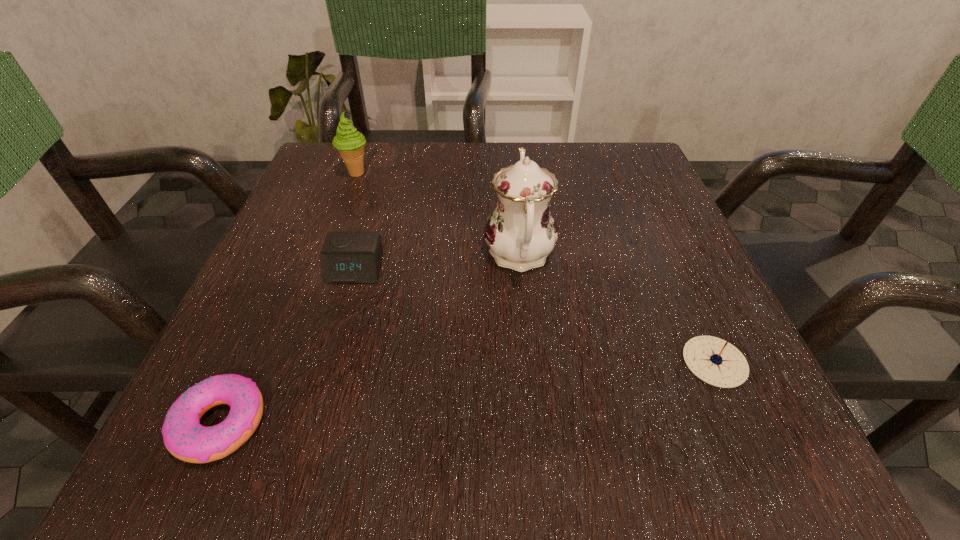
Where is `free space at the far edge`? The height and width of the screenshot is (540, 960). free space at the far edge is located at coordinates (484, 199).

Where is `vacant region at the near edge of the desktop`? vacant region at the near edge of the desktop is located at coordinates pos(417,415).

In the image, there is a desktop. Where is `vacant space at the left edge`? This screenshot has width=960, height=540. vacant space at the left edge is located at coordinates (341, 303).

Locate an element on the screen. free space at the right edge is located at coordinates (672, 271).

Find the location of a particular element. This screenshot has height=540, width=960. free space at the far left corner of the desktop is located at coordinates (323, 141).

The width and height of the screenshot is (960, 540). Identify the location of free space at the near left corner of the desktop. (227, 415).

Find the location of a particular element. The height and width of the screenshot is (540, 960). vacant region at the far right corner is located at coordinates (634, 150).

Image resolution: width=960 pixels, height=540 pixels. What are the coordinates of `vacant area at the near right corner of the desktop` in the screenshot? It's located at (756, 420).

Where is `unoccupied area between the tallest object and the third shortest object`? Image resolution: width=960 pixels, height=540 pixels. unoccupied area between the tallest object and the third shortest object is located at coordinates (438, 262).

Where is `free area in between the chinaware and the alarm clock`? free area in between the chinaware and the alarm clock is located at coordinates (438, 262).